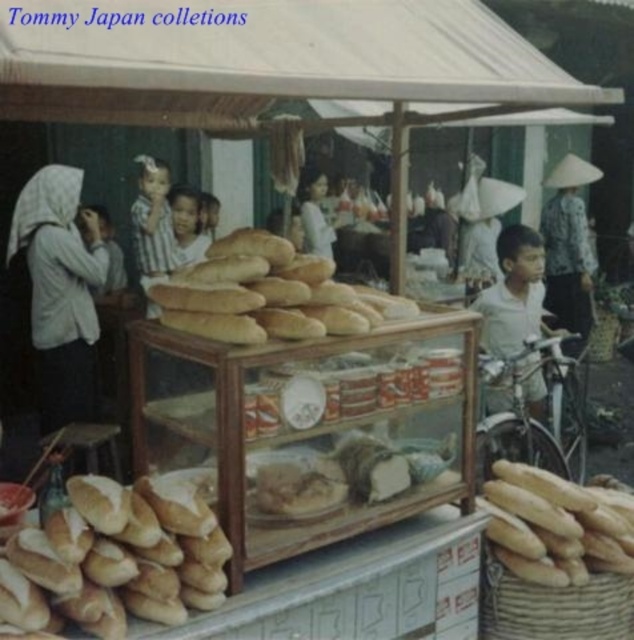
Does white cloth headscarf at left have a larger size compared to white cotton shirt at center?

Indeed, white cloth headscarf at left has a larger size compared to white cotton shirt at center.

Is white cloth headscarf at left further to the viewer compared to white cotton shirt at center?

No, it is not.

Identify the location of white cloth headscarf at left. (60, 291).

Image resolution: width=634 pixels, height=640 pixels. Identify the location of white cloth headscarf at left. (60, 291).

Can you confirm if golden brown crusty baguettes at center is wider than golden brown crusty baguette at lower right?

Yes, golden brown crusty baguettes at center is wider than golden brown crusty baguette at lower right.

Where is `golden brown crusty baguettes at center`? The image size is (634, 640). golden brown crusty baguettes at center is located at coordinates (261, 292).

Which is above, golden brown crusty baguette at lower right or white cotton shirt at center?

white cotton shirt at center is higher up.

Does golden brown crusty baguette at lower right come in front of white cotton shirt at center?

Yes, golden brown crusty baguette at lower right is closer to the viewer.

Does point (522, 532) come farther from viewer compared to point (328, 243)?

That is False.

At what (x,y) coordinates should I click in order to perform the action: click on golden brown crusty baguette at lower right. Please return your answer as a coordinate pair (x, y). The height and width of the screenshot is (640, 634). Looking at the image, I should click on (555, 525).